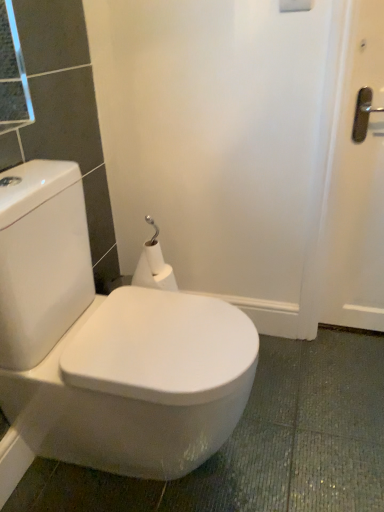
Question: Is white matte toilet paper at center wider than white glossy toilet at center?

Choices:
 (A) no
 (B) yes

Answer: (A)

Question: Is white matte toilet paper at center outside of white glossy toilet at center?

Choices:
 (A) yes
 (B) no

Answer: (A)

Question: Is white matte toilet paper at center at the left side of white glossy toilet at center?

Choices:
 (A) no
 (B) yes

Answer: (A)

Question: Can you confirm if white matte toilet paper at center is bigger than white glossy toilet at center?

Choices:
 (A) yes
 (B) no

Answer: (B)

Question: Considering the relative positions of white matte toilet paper at center and white glossy toilet at center in the image provided, is white matte toilet paper at center in front of white glossy toilet at center?

Choices:
 (A) no
 (B) yes

Answer: (A)

Question: From a real-world perspective, is white matte toilet paper at center located higher than white glossy toilet at center?

Choices:
 (A) yes
 (B) no

Answer: (A)

Question: From the image's perspective, is white glossy toilet at center on top of white matte toilet paper at center?

Choices:
 (A) yes
 (B) no

Answer: (B)

Question: Is white matte toilet paper at center located within white glossy toilet at center?

Choices:
 (A) yes
 (B) no

Answer: (B)

Question: Is white glossy toilet at center positioned beyond the bounds of white matte toilet paper at center?

Choices:
 (A) no
 (B) yes

Answer: (B)

Question: Is white glossy toilet at center positioned behind white matte toilet paper at center?

Choices:
 (A) yes
 (B) no

Answer: (B)

Question: Considering the relative positions of white glossy toilet at center and white matte toilet paper at center in the image provided, is white glossy toilet at center in front of white matte toilet paper at center?

Choices:
 (A) yes
 (B) no

Answer: (A)

Question: Is there a large distance between white glossy toilet at center and white matte toilet paper at center?

Choices:
 (A) no
 (B) yes

Answer: (A)

Question: Is white glossy toilet at center spatially inside white matte toilet paper at center, or outside of it?

Choices:
 (A) outside
 (B) inside

Answer: (A)